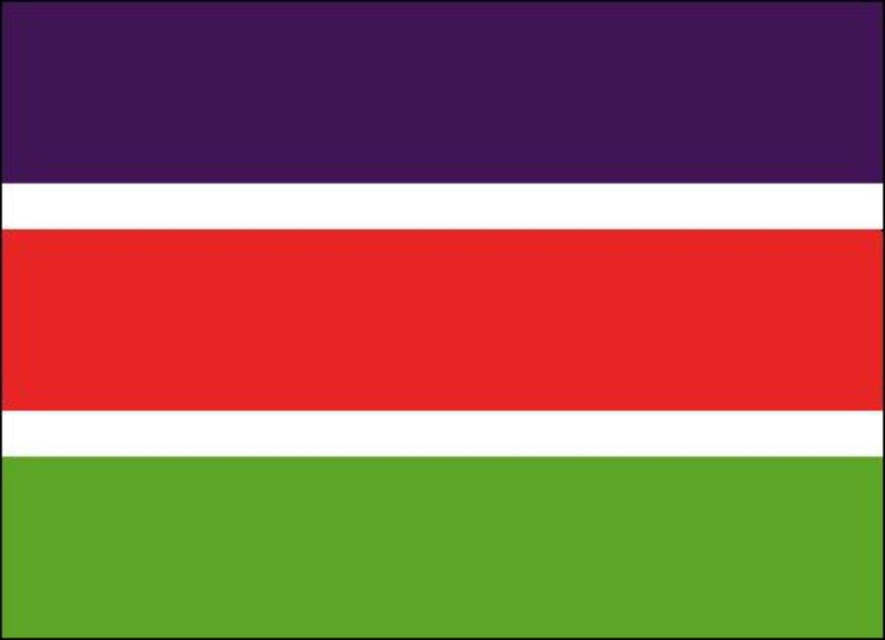
Question: Which point is farther to the camera?

Choices:
 (A) (491, 112)
 (B) (405, 580)

Answer: (A)

Question: Is purple matte rectangle at upper left closer to the viewer compared to green matte rectangle at bottom?

Choices:
 (A) no
 (B) yes

Answer: (B)

Question: Considering the real-world distances, which object is closest to the green matte rectangle at bottom?

Choices:
 (A) purple matte rectangle at upper left
 (B) matte red rectangle at center

Answer: (B)

Question: Is matte red rectangle at center to the right of green matte rectangle at bottom from the viewer's perspective?

Choices:
 (A) no
 (B) yes

Answer: (B)

Question: Can you confirm if purple matte rectangle at upper left is smaller than matte red rectangle at center?

Choices:
 (A) yes
 (B) no

Answer: (B)

Question: Which of the following is the farthest from the observer?

Choices:
 (A) purple matte rectangle at upper left
 (B) matte red rectangle at center
 (C) green matte rectangle at bottom

Answer: (B)